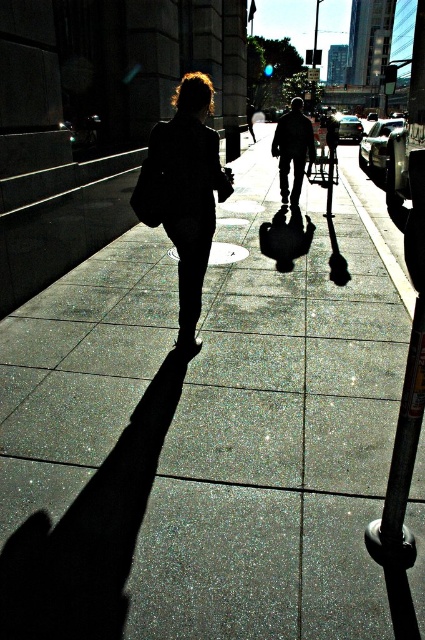
Question: Does dark textured jacket at center appear under metallic gray parking meter at center-right?

Choices:
 (A) no
 (B) yes

Answer: (B)

Question: Does black matte jacket at center have a greater width compared to metallic gray parking meter at center-right?

Choices:
 (A) yes
 (B) no

Answer: (B)

Question: Which object is farther from the camera taking this photo?

Choices:
 (A) metallic gray parking meter at center-right
 (B) dark textured jacket at center
 (C) black matte jacket at center

Answer: (A)

Question: Does black matte jacket at center appear over dark textured jacket at center?

Choices:
 (A) no
 (B) yes

Answer: (A)

Question: Which object is the farthest from the dark textured jacket at center?

Choices:
 (A) black matte jacket at center
 (B) metallic gray parking meter at center-right

Answer: (A)

Question: Which point is closer to the camera taking this photo?

Choices:
 (A) (181, 257)
 (B) (289, 140)
 (C) (331, 160)

Answer: (A)